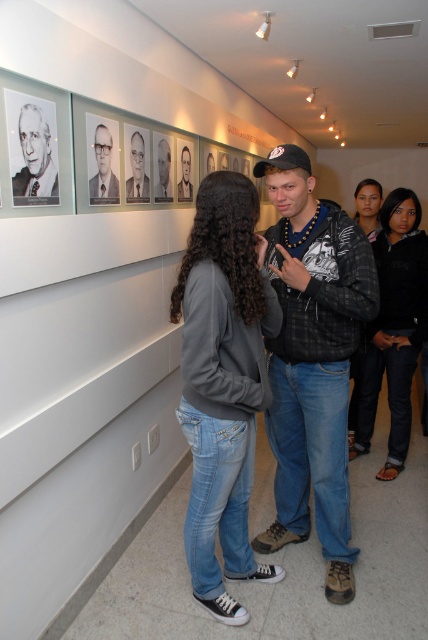
Does point (410, 204) come farther from viewer compared to point (187, 172)?

No, (410, 204) is closer to viewer.

Consider the image. Between black matte jacket at lower right and smooth black suit at upper center, which one is positioned lower?

black matte jacket at lower right is below.

This screenshot has width=428, height=640. In order to click on black matte jacket at lower right in this screenshot , I will do `click(395, 326)`.

Does point (335, 454) lie in front of point (100, 182)?

No, it is not.

Is black leather jacket at center to the left of black glossy photo frame at upper center from the viewer's perspective?

Incorrect, black leather jacket at center is not on the left side of black glossy photo frame at upper center.

Where is `black leather jacket at center`? black leather jacket at center is located at coordinates (312, 360).

You are a GUI agent. You are given a task and a screenshot of the screen. Output one action in this format:
    pyautogui.click(x=<x>, y=<y>)
    Task: Click on the black leather jacket at center
    Image resolution: width=428 pixels, height=640 pixels.
    Given the screenshot: What is the action you would take?
    pyautogui.click(x=312, y=360)

Which of these two, dark gray sweater at right or black glossy photo frame at upper center, stands shorter?

black glossy photo frame at upper center

Which of these two, dark gray sweater at right or black glossy photo frame at upper center, stands taller?

With more height is dark gray sweater at right.

Which is in front, point (353, 376) or point (100, 176)?

Point (100, 176)

At what (x,y) coordinates should I click in order to perform the action: click on dark gray sweater at right. Please return your answer as a coordinate pair (x, y). The height and width of the screenshot is (640, 428). Looking at the image, I should click on (x=368, y=205).